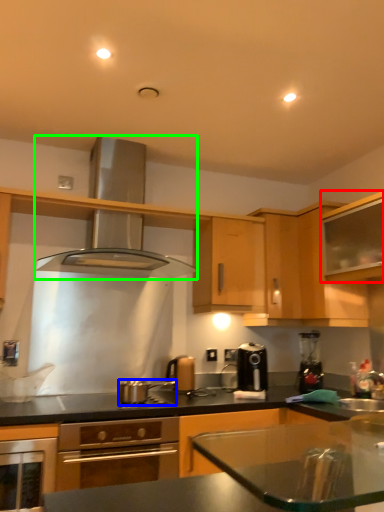
Question: Based on their relative distances, which object is farther from cabinetry (highlighted by a red box)? Choose from kitchen appliance (highlighted by a blue box) and exhaust hood (highlighted by a green box).

Choices:
 (A) kitchen appliance
 (B) exhaust hood

Answer: (A)